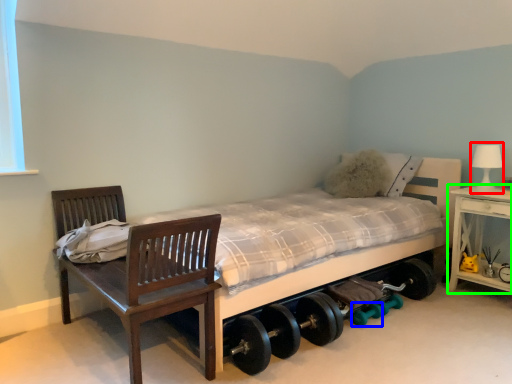
Question: Which object is positioned farthest from table lamp (highlighted by a red box)? Select from dumbbell (highlighted by a blue box) and nightstand (highlighted by a green box).

Choices:
 (A) dumbbell
 (B) nightstand

Answer: (A)